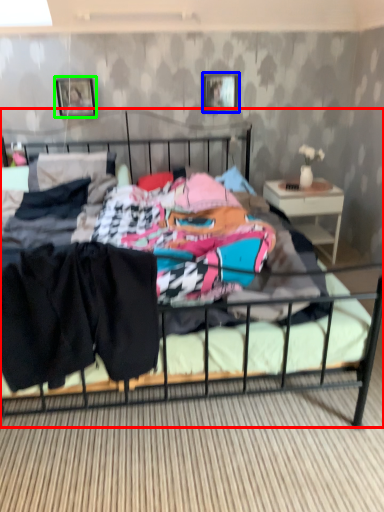
Question: Which is farther away from bed (highlighted by a red box)? picture frame (highlighted by a blue box) or picture frame (highlighted by a green box)?

Choices:
 (A) picture frame
 (B) picture frame

Answer: (B)